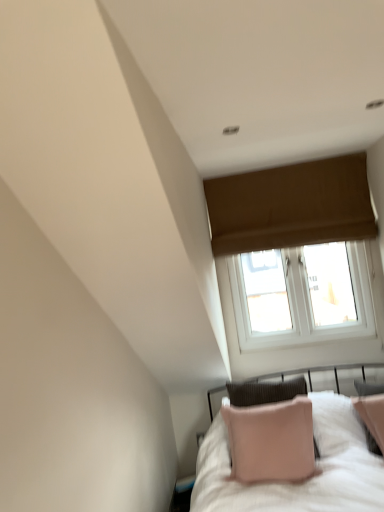
Identify the location of brown fabric window at upper center. The height and width of the screenshot is (512, 384). tap(291, 206).

What do you see at coordinates (291, 206) in the screenshot? Image resolution: width=384 pixels, height=512 pixels. I see `brown fabric window at upper center` at bounding box center [291, 206].

You are a GUI agent. You are given a task and a screenshot of the screen. Output one action in this format:
    pyautogui.click(x=<x>, y=<y>)
    Task: Click on the pink fabric pillow at lower right
    
    Given the screenshot: What is the action you would take?
    pyautogui.click(x=297, y=482)

Describe the element at coordinates (297, 482) in the screenshot. The width and height of the screenshot is (384, 512). I see `pink fabric pillow at lower right` at that location.

Locate an element on the screen. This screenshot has width=384, height=512. brown fabric window at upper center is located at coordinates (291, 206).

Considering the relative positions of pink fabric pillow at lower right and brown fabric window at upper center in the image provided, is pink fabric pillow at lower right to the right of brown fabric window at upper center from the viewer's perspective?

In fact, pink fabric pillow at lower right is to the left of brown fabric window at upper center.

Based on the photo, relative to brown fabric window at upper center, is pink fabric pillow at lower right in front or behind?

In the image, pink fabric pillow at lower right appears in front of brown fabric window at upper center.

Is point (212, 484) closer to camera compared to point (359, 173)?

Yes, it is in front of point (359, 173).

From the image's perspective, is pink fabric pillow at lower right located above brown fabric window at upper center?

No, from the image's perspective, pink fabric pillow at lower right is not above brown fabric window at upper center.

From a real-world perspective, is pink fabric pillow at lower right located higher than brown fabric window at upper center?

No, from a real-world perspective, pink fabric pillow at lower right is not above brown fabric window at upper center.

Which of these two, pink fabric pillow at lower right or brown fabric window at upper center, is wider?

With larger width is pink fabric pillow at lower right.

In terms of height, does pink fabric pillow at lower right look taller or shorter compared to brown fabric window at upper center?

Considering their sizes, pink fabric pillow at lower right has less height than brown fabric window at upper center.

Is pink fabric pillow at lower right smaller than brown fabric window at upper center?

Actually, pink fabric pillow at lower right might be larger than brown fabric window at upper center.

Choose the correct answer: Is pink fabric pillow at lower right inside brown fabric window at upper center or outside it?

pink fabric pillow at lower right is spatially situated outside brown fabric window at upper center.

Consider the image. Is the surface of pink fabric pillow at lower right in direct contact with brown fabric window at upper center?

pink fabric pillow at lower right is not next to brown fabric window at upper center, and they're not touching.

Is pink fabric pillow at lower right aimed at brown fabric window at upper center?

No, pink fabric pillow at lower right is not turned towards brown fabric window at upper center.

How different are the orientations of pink fabric pillow at lower right and brown fabric window at upper center in degrees?

There is a 6.22-degree angle between the facing directions of pink fabric pillow at lower right and brown fabric window at upper center.

Measure the distance from pink fabric pillow at lower right to brown fabric window at upper center.

pink fabric pillow at lower right and brown fabric window at upper center are 1.39 meters apart from each other.

You are a GUI agent. You are given a task and a screenshot of the screen. Output one action in this format:
    pyautogui.click(x=<x>, y=<y>)
    Task: Click on the bed below the brown fabric window at upper center (from the image's perspective)
    The width and height of the screenshot is (384, 512).
    Given the screenshot: What is the action you would take?
    pyautogui.click(x=297, y=482)

Consider the image. Considering the relative positions of brown fabric window at upper center and pink fabric pillow at lower right in the image provided, is brown fabric window at upper center to the left of pink fabric pillow at lower right from the viewer's perspective?

Incorrect, brown fabric window at upper center is not on the left side of pink fabric pillow at lower right.

From the picture: Is brown fabric window at upper center in front of or behind pink fabric pillow at lower right in the image?

brown fabric window at upper center is positioned farther from the viewer than pink fabric pillow at lower right.

Considering the positions of points (337, 215) and (257, 498), is point (337, 215) closer to camera compared to point (257, 498)?

No, (337, 215) is further to viewer.

From the image's perspective, is brown fabric window at upper center above pink fabric pillow at lower right?

Yes.

From a real-world perspective, is brown fabric window at upper center on pink fabric pillow at lower right?

Yes, from a real-world perspective, brown fabric window at upper center is above pink fabric pillow at lower right.

Does brown fabric window at upper center have a lesser width compared to pink fabric pillow at lower right?

Yes.

Considering the relative sizes of brown fabric window at upper center and pink fabric pillow at lower right in the image provided, is brown fabric window at upper center shorter than pink fabric pillow at lower right?

Incorrect, the height of brown fabric window at upper center does not fall short of that of pink fabric pillow at lower right.

Is brown fabric window at upper center smaller than pink fabric pillow at lower right?

Yes, brown fabric window at upper center is smaller than pink fabric pillow at lower right.

Is brown fabric window at upper center spatially inside pink fabric pillow at lower right, or outside of it?

brown fabric window at upper center is located beyond the bounds of pink fabric pillow at lower right.

Looking at this image, is brown fabric window at upper center placed right next to pink fabric pillow at lower right?

brown fabric window at upper center and pink fabric pillow at lower right are not in contact.

Is brown fabric window at upper center positioned with its back to pink fabric pillow at lower right?

No, brown fabric window at upper center's orientation is not away from pink fabric pillow at lower right.

Measure the distance from brown fabric window at upper center to pink fabric pillow at lower right.

1.39 meters.

The width and height of the screenshot is (384, 512). Identify the location of bed beneath the brown fabric window at upper center (from a real-world perspective). (297, 482).

You are a GUI agent. You are given a task and a screenshot of the screen. Output one action in this format:
    pyautogui.click(x=<x>, y=<y>)
    Task: Click on the window located above the pink fabric pillow at lower right (from the image's perspective)
    
    Given the screenshot: What is the action you would take?
    pyautogui.click(x=291, y=206)

Find the location of a particular element. The height and width of the screenshot is (512, 384). bed located in front of the brown fabric window at upper center is located at coordinates (297, 482).